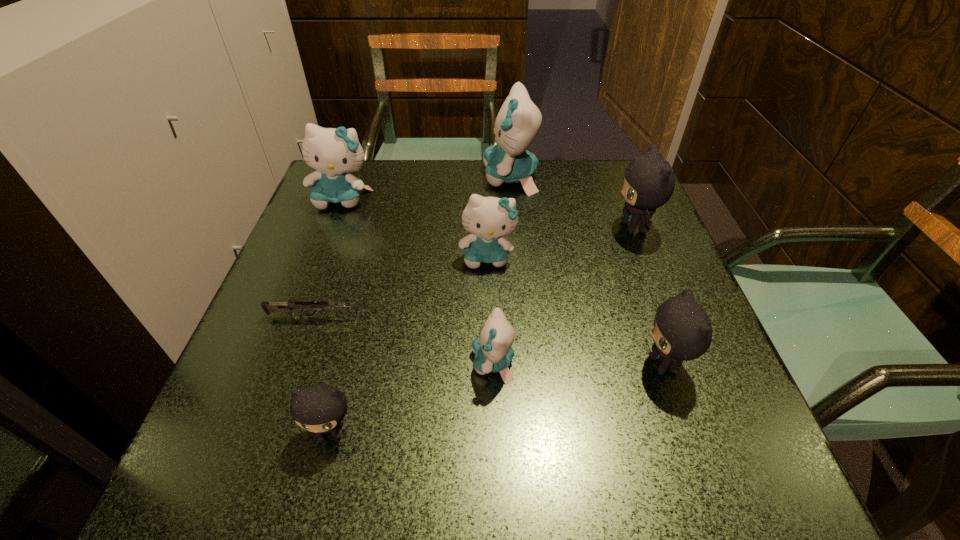
Where is `the fifth closest kitten to the nearest blue kitten`? This screenshot has height=540, width=960. the fifth closest kitten to the nearest blue kitten is located at coordinates (517, 124).

Identify which blue kitten is the third closest to the second farthest gray kitten. Please provide its 2D coordinates. Your answer should be formatted as a tuple, i.e. [(x, y)], where the tuple contains the x and y coordinates of a point satisfying the conditions above.

[(517, 124)]

I want to click on the third closest blue kitten to the smallest gray kitten, so click(x=333, y=152).

You are a GUI agent. You are given a task and a screenshot of the screen. Output one action in this format:
    pyautogui.click(x=<x>, y=<y>)
    Task: Click on the second closest gray kitten relative to the nearest kitten
    This screenshot has height=540, width=960.
    Given the screenshot: What is the action you would take?
    pyautogui.click(x=649, y=181)

Identify which gray kitten is the closest to the third biggest blue kitten. Please provide its 2D coordinates. Your answer should be formatted as a tuple, i.e. [(x, y)], where the tuple contains the x and y coordinates of a point satisfying the conditions above.

[(649, 181)]

Find the location of `free spot that satisfies the following two spatial constraints: 1. on the face of the smallest blue kitten; 2. on the front-facing side of the smallest gray kitten`. free spot that satisfies the following two spatial constraints: 1. on the face of the smallest blue kitten; 2. on the front-facing side of the smallest gray kitten is located at coordinates (494, 431).

The image size is (960, 540). In order to click on vacant space that satisfies the following two spatial constraints: 1. on the front-facing side of the biggest gray kitten; 2. on the front-facing side of the nearest object in this screenshot , I will do `click(714, 431)`.

The height and width of the screenshot is (540, 960). Find the location of `vacant space that satisfies the following two spatial constraints: 1. on the face of the tallest kitten; 2. on the front-facing side of the nearest kitten`. vacant space that satisfies the following two spatial constraints: 1. on the face of the tallest kitten; 2. on the front-facing side of the nearest kitten is located at coordinates (533, 431).